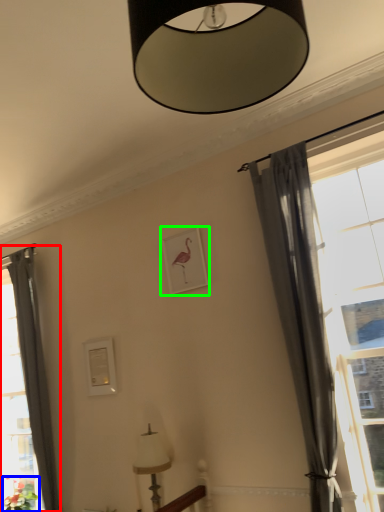
Question: Which is nearer to the curtain (highlighted by a red box)? plant (highlighted by a blue box) or picture frame (highlighted by a green box).

Choices:
 (A) plant
 (B) picture frame

Answer: (A)